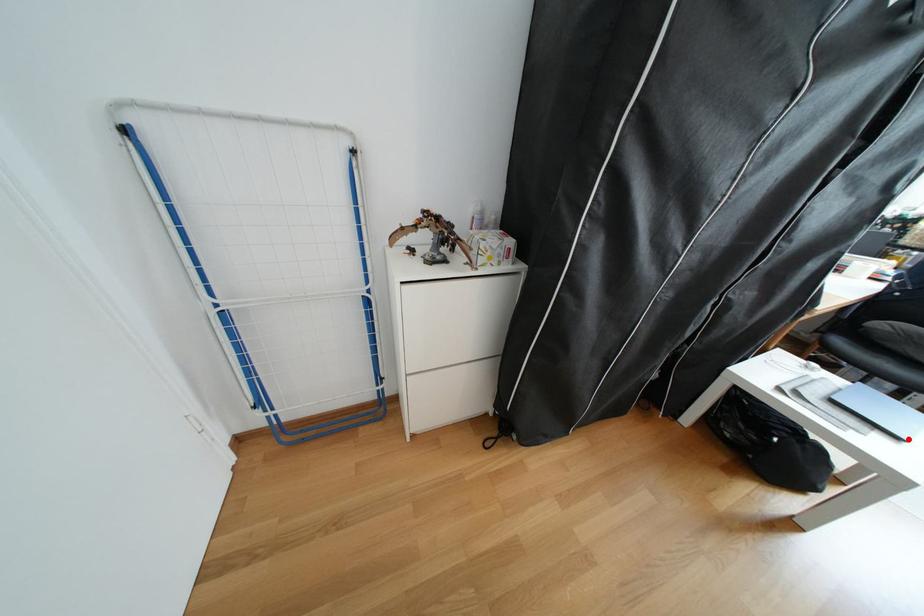
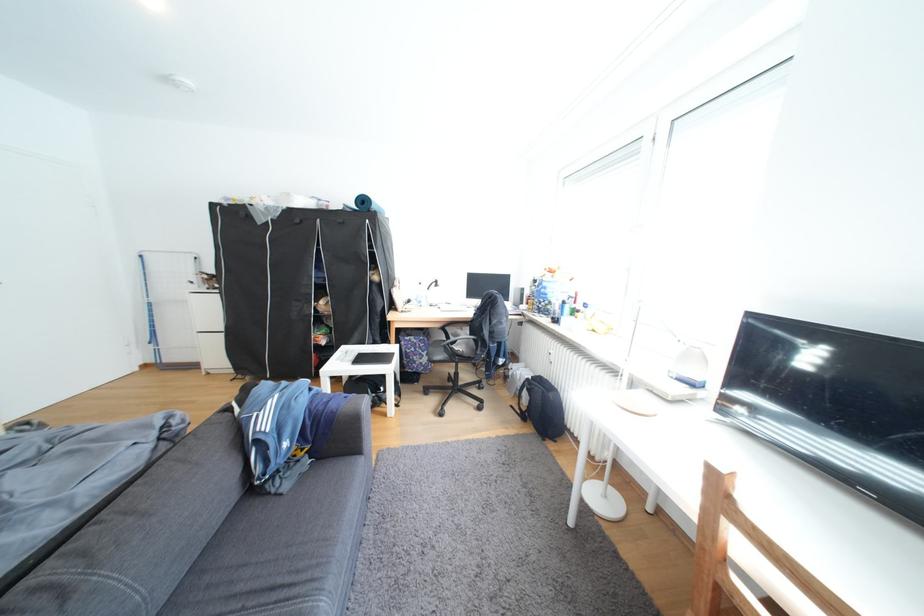
Find the pixel in the second image that matches the highlighted location in the first image.

(367, 365)